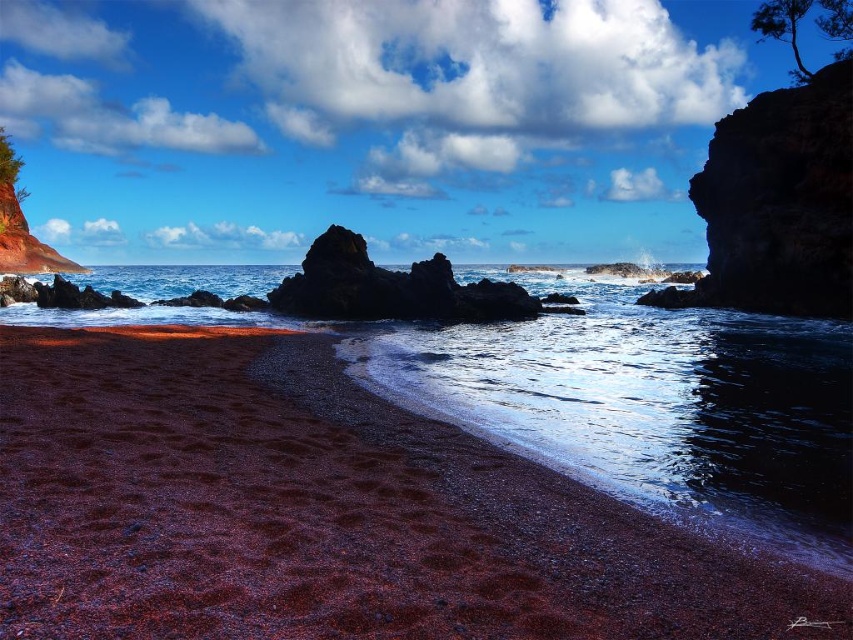
Does glistening water at center appear over green rough tree at upper left?

No.

Is glistening water at center wider than green rough tree at upper left?

In fact, glistening water at center might be narrower than green rough tree at upper left.

Who is more distant from viewer, (x=846, y=369) or (x=13, y=180)?

The point (x=13, y=180) is more distant.

Where is `glistening water at center`? glistening water at center is located at coordinates (646, 403).

From the picture: Which of these two, smooth dark rock at center or green leafy tree at upper right, stands taller?

green leafy tree at upper right

Is point (288, 304) positioned before point (791, 48)?

Yes.

The height and width of the screenshot is (640, 853). What are the coordinates of `smooth dark rock at center` in the screenshot? It's located at (389, 288).

Can you confirm if dark red gravel at lower left is bigger than green rough tree at upper left?

No.

Where is `dark red gravel at lower left`? dark red gravel at lower left is located at coordinates (325, 513).